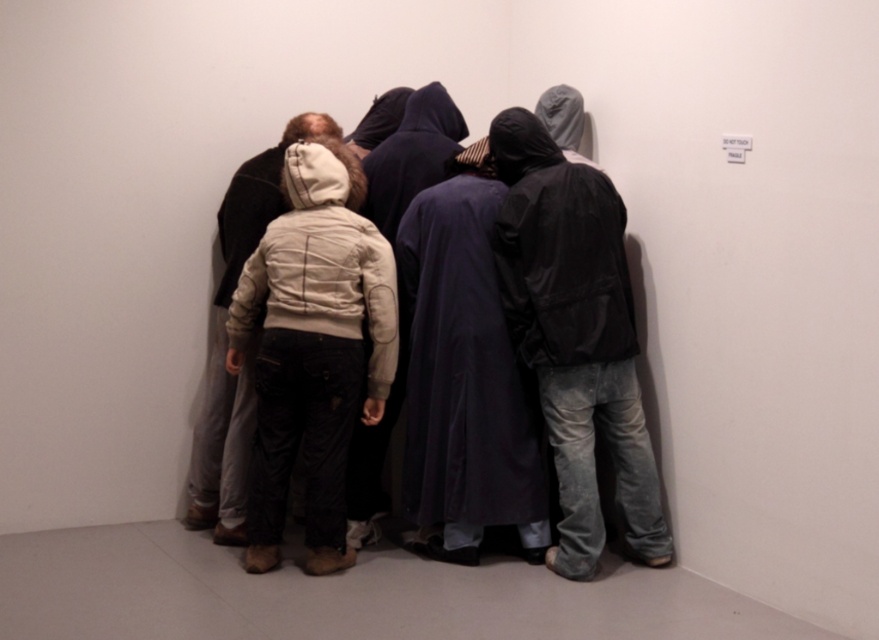
You are standing in the art gallery and see the matte black jacket at center and the light beige jacket at center. Which one appears taller?

The matte black jacket at center is much taller than the light beige jacket at center.

You are standing in the art gallery and notice two jackets in the center of the group. The matte black jacket at center and the light beige jacket at center. If you want to reach both jackets without moving, which one is closer to your current position?

The matte black jacket at center is 1.50 meters away from the light beige jacket at center. Since you are not moving, both jackets are at fixed distances from you. The question cannot be answered definitively without knowing your exact position relative to them.

You are an event organizer who needs to arrange name tags for attendees. You see the matte black jacket at center and the light beige jacket at center. Which jacket should you place a name tag on if the person wearing the matte black jacket is in front?

The matte black jacket at center is positioned under the light beige jacket at center, so the person wearing the matte black jacket is closer to you. Therefore, you should place the name tag on the matte black jacket at center.